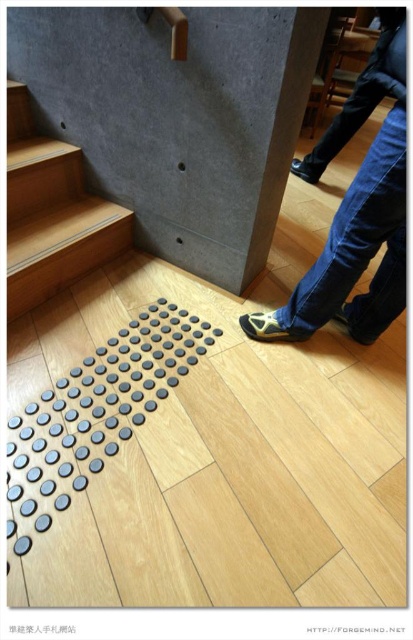
Which is behind, point (386, 38) or point (9, 173)?

The point (9, 173) is behind.

Is denim jeans at lower right wider than wooden at left?

Correct, the width of denim jeans at lower right exceeds that of wooden at left.

The width and height of the screenshot is (413, 640). What do you see at coordinates (356, 211) in the screenshot? I see `denim jeans at lower right` at bounding box center [356, 211].

I want to click on denim jeans at lower right, so (356, 211).